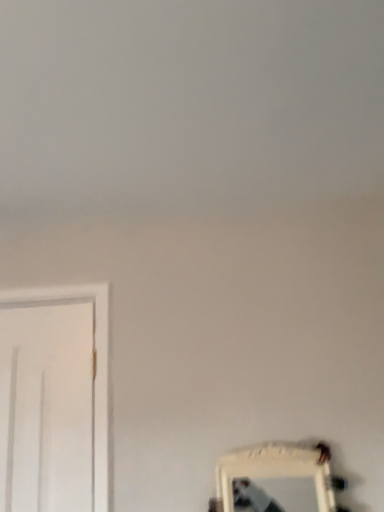
Question: Should I look upward or downward to see white framed mirror at lower right?

Choices:
 (A) down
 (B) up

Answer: (A)